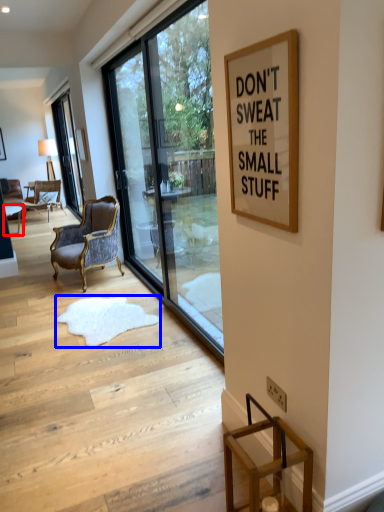
Question: Which object is further to the camera taking this photo, table (highlighted by a red box) or doormat (highlighted by a blue box)?

Choices:
 (A) table
 (B) doormat

Answer: (A)